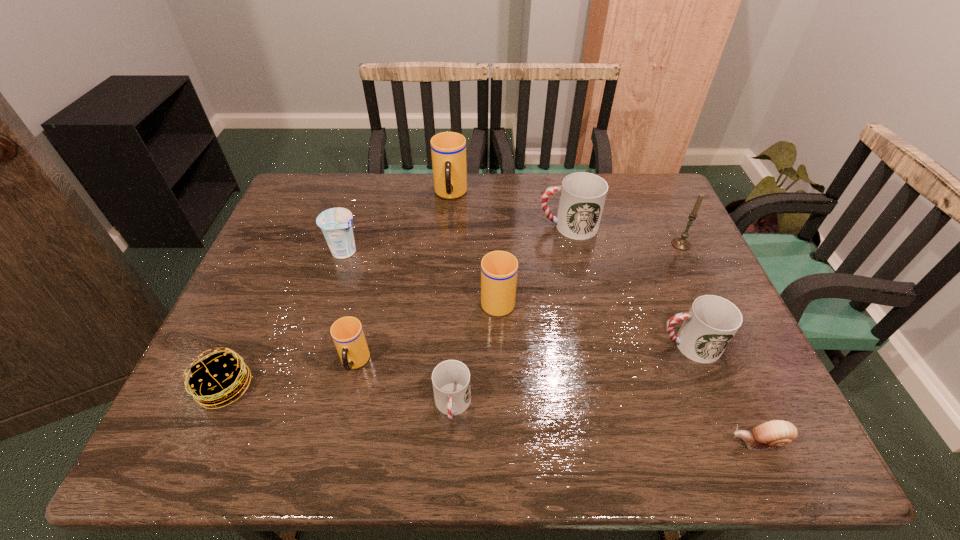
This screenshot has height=540, width=960. In order to click on the rightmost red cup in this screenshot , I will do `click(712, 321)`.

Find the location of a particular element. the smallest beige cup is located at coordinates (347, 333).

Find the location of a particular element. The width and height of the screenshot is (960, 540). the eighth object from right to left is located at coordinates (347, 333).

This screenshot has width=960, height=540. What are the coordinates of `patty` in the screenshot? It's located at (219, 378).

At what (x,y) coordinates should I click in order to perform the action: click on the nearest red cup. Please return your answer as a coordinate pair (x, y). This screenshot has height=540, width=960. Looking at the image, I should click on (451, 379).

Find the location of `the leftmost red cup`. the leftmost red cup is located at coordinates (451, 379).

Find the location of `escargot`. escargot is located at coordinates (776, 433).

Where is `the shortest object`? This screenshot has height=540, width=960. the shortest object is located at coordinates (776, 433).

In order to click on free spot located 0.270m on the side of the second beige cup from right to left with the handle in this screenshot , I will do `click(444, 270)`.

Where is `vacant space located on the front of the candle`? vacant space located on the front of the candle is located at coordinates (714, 314).